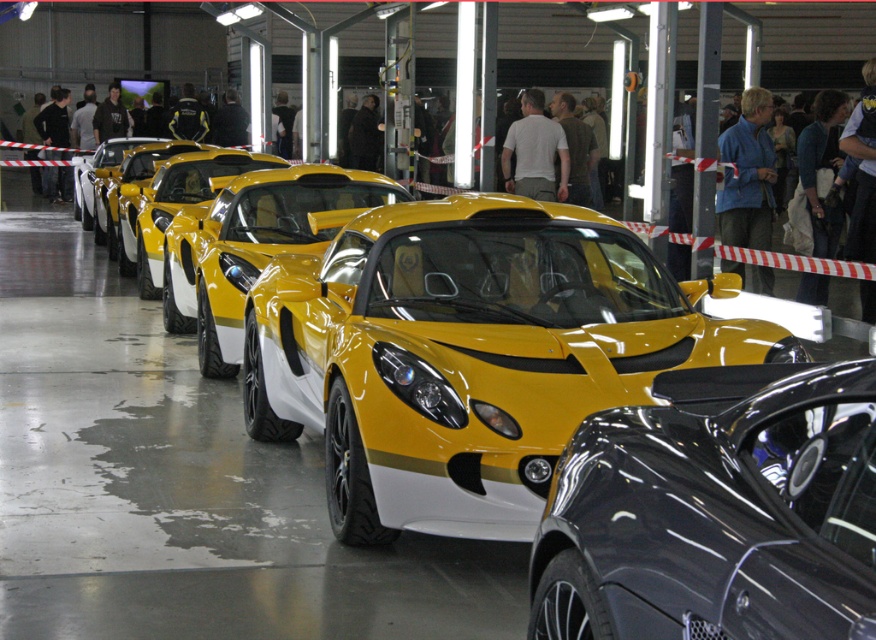
Which is more to the left, yellow matte sports car at center or glossy black car at center?

yellow matte sports car at center is more to the left.

Where is `yellow matte sports car at center`? Image resolution: width=876 pixels, height=640 pixels. yellow matte sports car at center is located at coordinates (468, 355).

Based on the photo, who is more forward, (557, 452) or (563, 513)?

Point (563, 513) is more forward.

Find the location of a particular element. The height and width of the screenshot is (640, 876). yellow matte sports car at center is located at coordinates (468, 355).

Is glossy black car at center to the left of yellow glossy sports car at center from the viewer's perspective?

Incorrect, glossy black car at center is not on the left side of yellow glossy sports car at center.

Is glossy black car at center positioned before yellow glossy sports car at center?

Yes, glossy black car at center is closer to the viewer.

Who is more forward, (x=560, y=628) or (x=375, y=186)?

Positioned in front is point (x=560, y=628).

Locate an element on the screen. The image size is (876, 640). glossy black car at center is located at coordinates (716, 513).

The height and width of the screenshot is (640, 876). Describe the element at coordinates (468, 355) in the screenshot. I see `yellow matte sports car at center` at that location.

Can you confirm if yellow matte sports car at center is positioned to the right of yellow glossy sports car at center?

Yes, yellow matte sports car at center is to the right of yellow glossy sports car at center.

Describe the element at coordinates (468, 355) in the screenshot. The height and width of the screenshot is (640, 876). I see `yellow matte sports car at center` at that location.

At what (x,y) coordinates should I click in order to perform the action: click on yellow matte sports car at center. Please return your answer as a coordinate pair (x, y). The height and width of the screenshot is (640, 876). Looking at the image, I should click on (468, 355).